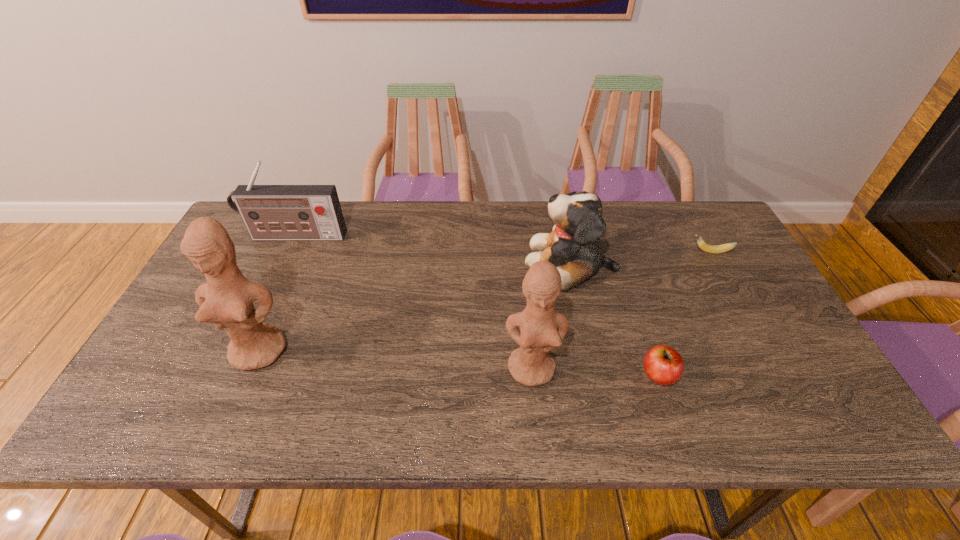
Where is `the tallest object`? the tallest object is located at coordinates (226, 300).

Find the location of a particular element. The image size is (960, 540). the taller figurine is located at coordinates (226, 300).

Where is `the right figurine`? the right figurine is located at coordinates [x=542, y=329].

Locate an element on the screen. radio receiver is located at coordinates (270, 212).

The height and width of the screenshot is (540, 960). What are the coordinates of `banana` in the screenshot? It's located at (715, 249).

The width and height of the screenshot is (960, 540). What are the coordinates of `the rightmost object` in the screenshot? It's located at (x=715, y=249).

You are a GUI agent. You are given a task and a screenshot of the screen. Output one action in this format:
    pyautogui.click(x=<x>, y=<y>)
    Task: Click on the puppy
    This screenshot has width=960, height=540.
    Given the screenshot: What is the action you would take?
    pyautogui.click(x=572, y=246)

Locate an element on the screen. apple is located at coordinates (663, 365).

This screenshot has height=540, width=960. In order to click on free space located on the front-facing side of the taller figurine in this screenshot , I will do `click(242, 392)`.

Locate an element on the screen. The image size is (960, 540). free space located 0.220m on the front panel of the radio receiver is located at coordinates (268, 295).